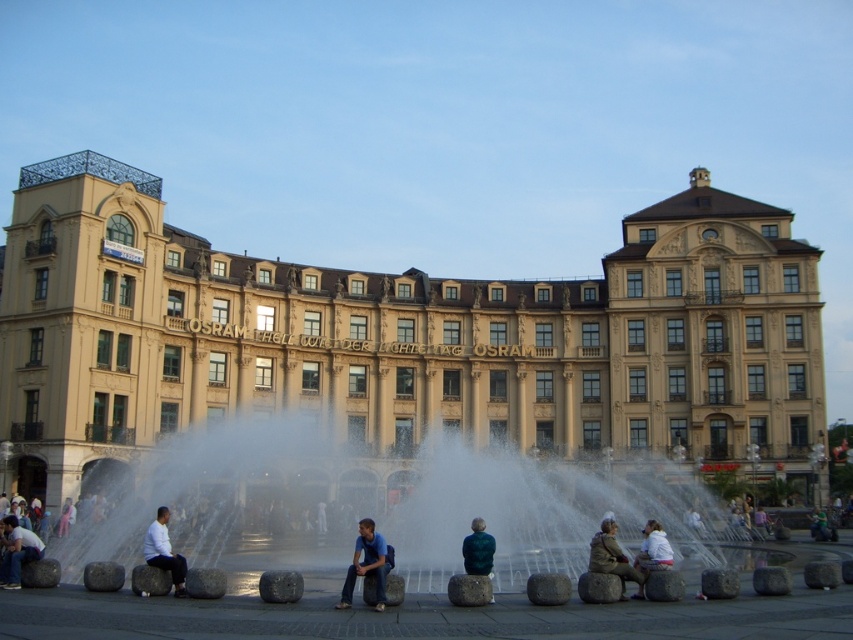
You are standing in front of the OSRAM building and want to take a photo of the white stone fountain at center and the white matte shirt at lower left. Which object is wider?

The white stone fountain at center is wider than the white matte shirt at lower left.